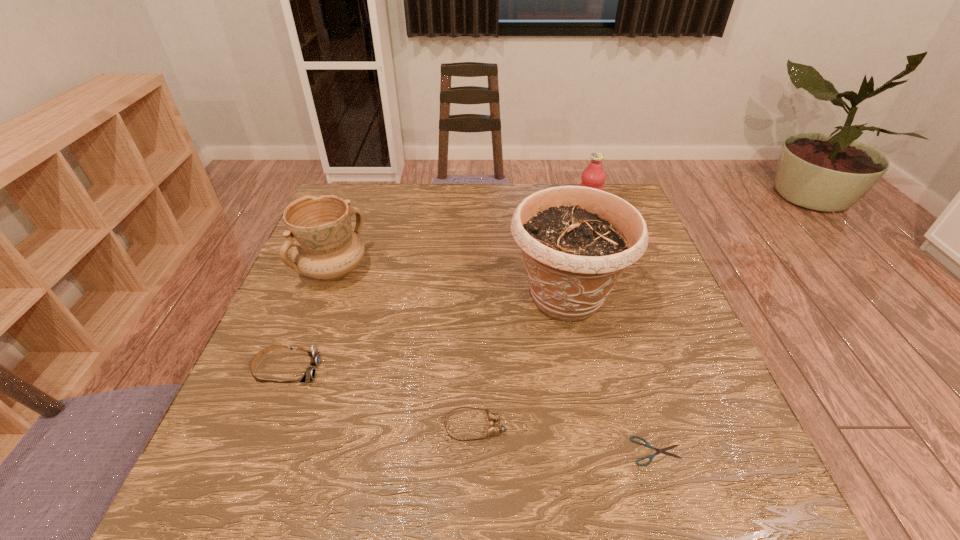
Image resolution: width=960 pixels, height=540 pixels. I want to click on vacant area in the image that satisfies the following two spatial constraints: 1. on the front side of the flowerpot; 2. on the right side of the shortest object, so click(598, 451).

Where is `free spot that satisfies the following two spatial constraints: 1. on the front-facing side of the taller goggles; 2. on the back side of the shortest object`? free spot that satisfies the following two spatial constraints: 1. on the front-facing side of the taller goggles; 2. on the back side of the shortest object is located at coordinates (255, 451).

Locate an element on the screen. The width and height of the screenshot is (960, 540). vacant region that satisfies the following two spatial constraints: 1. on the front side of the pottery; 2. on the left side of the shears is located at coordinates (266, 451).

Find the location of a particular element. This screenshot has width=960, height=540. vacant space that satisfies the following two spatial constraints: 1. on the front side of the pottery; 2. on the front-facing side of the taller goggles is located at coordinates (296, 370).

In order to click on vacant space that satisfies the following two spatial constraints: 1. on the front-facing side of the left goggles; 2. on the left side of the shortest object in this screenshot , I will do `click(255, 451)`.